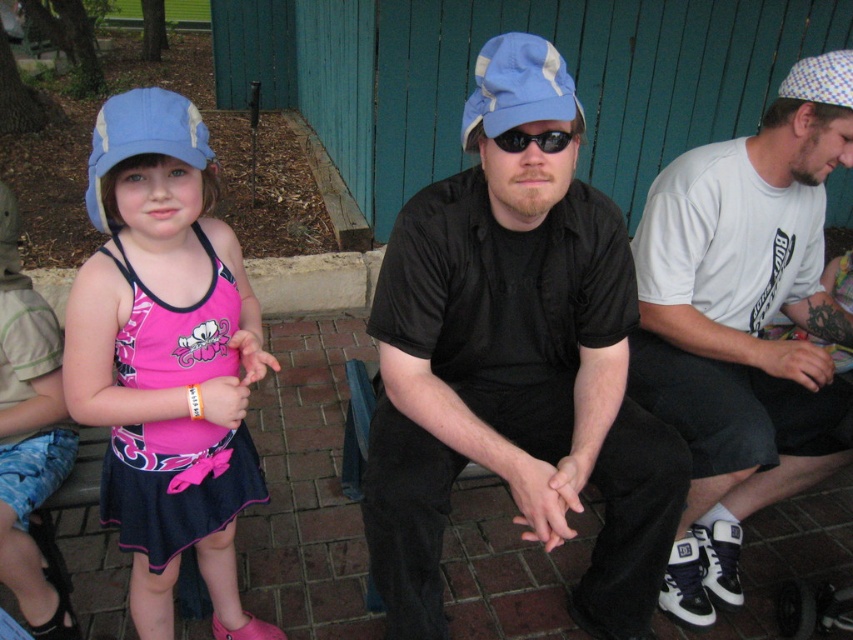
You are a photographer trying to capture a clear shot of the matte blue baseball cap at left and the black plastic sunglasses at center. Since you want to focus on both items, which object should you adjust your camera angle to prioritize capturing first based on their heights?

The matte blue baseball cap at left is taller than the black plastic sunglasses at center, so you should prioritize adjusting your camera angle to capture the matte blue baseball cap at left first since it has a greater height and may require more careful framing to ensure it fits within the shot.

You are standing in the park and see the matte blue baseball cap at left. Where exactly is it positioned in the image?

The matte blue baseball cap at left is located at point (141, 140).

Consider the image. You are a photographer trying to capture a closeup shot of the black plastic sunglasses at center. However, the matte blue baseball cap at left is blocking your view. Can you determine if the cap is above or below the sunglasses?

The matte blue baseball cap at left is below the black plastic sunglasses at center, so it is blocking the view from below and not obstructing the top part of the sunglasses.